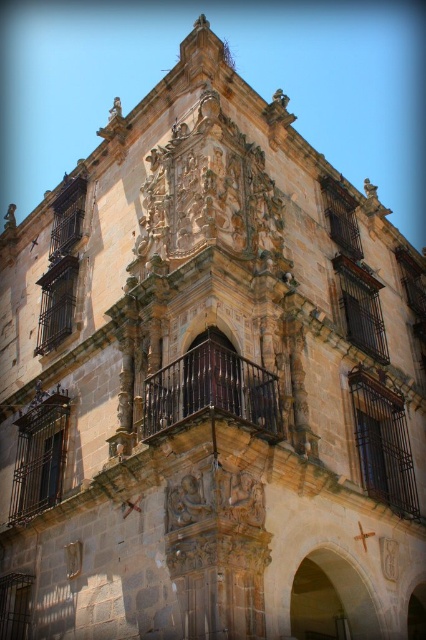
Is dark brown wrought iron balcony at center shorter than white matte clock at center?

In fact, dark brown wrought iron balcony at center may be taller than white matte clock at center.

Measure the distance between point (261,419) and camera.

The distance of point (261,419) from camera is 47.39 meters.

This screenshot has height=640, width=426. What do you see at coordinates (210, 388) in the screenshot?
I see `dark brown wrought iron balcony at center` at bounding box center [210, 388].

The width and height of the screenshot is (426, 640). Find the location of `dark brown wrought iron balcony at center`. dark brown wrought iron balcony at center is located at coordinates (210, 388).